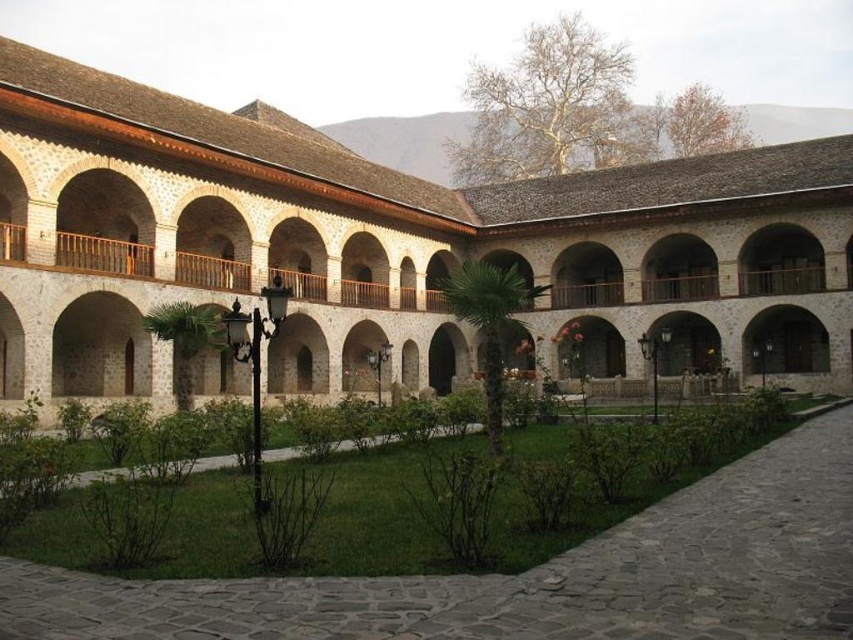
Question: Observing the image, what is the correct spatial positioning of white stone building at center in reference to green grass at center?

Choices:
 (A) right
 (B) left

Answer: (B)

Question: Which point is farther to the camera?

Choices:
 (A) green grass at center
 (B) white stone building at center

Answer: (B)

Question: Where is white stone building at center located in relation to green grass at center in the image?

Choices:
 (A) right
 (B) left

Answer: (B)

Question: Which object is farther from the camera taking this photo?

Choices:
 (A) white stone building at center
 (B) green grass at center

Answer: (A)

Question: Considering the relative positions of white stone building at center and green grass at center in the image provided, where is white stone building at center located with respect to green grass at center?

Choices:
 (A) left
 (B) right

Answer: (A)